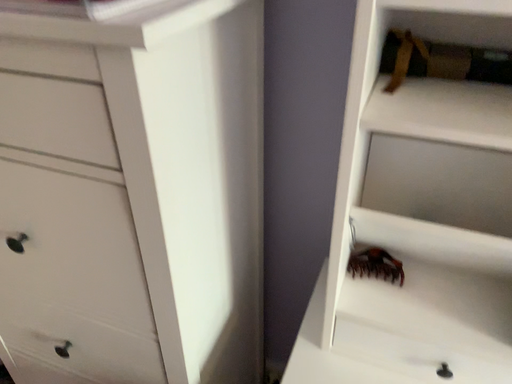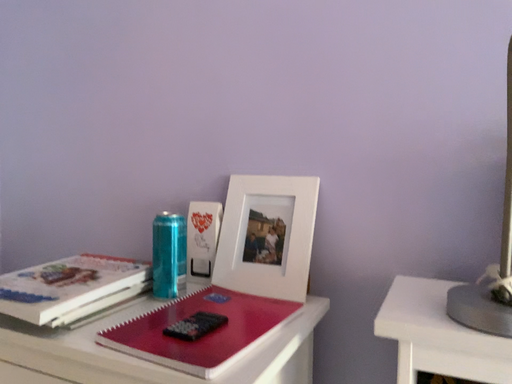
Question: Which way did the camera rotate in the video?

Choices:
 (A) rotated upward
 (B) rotated downward

Answer: (A)